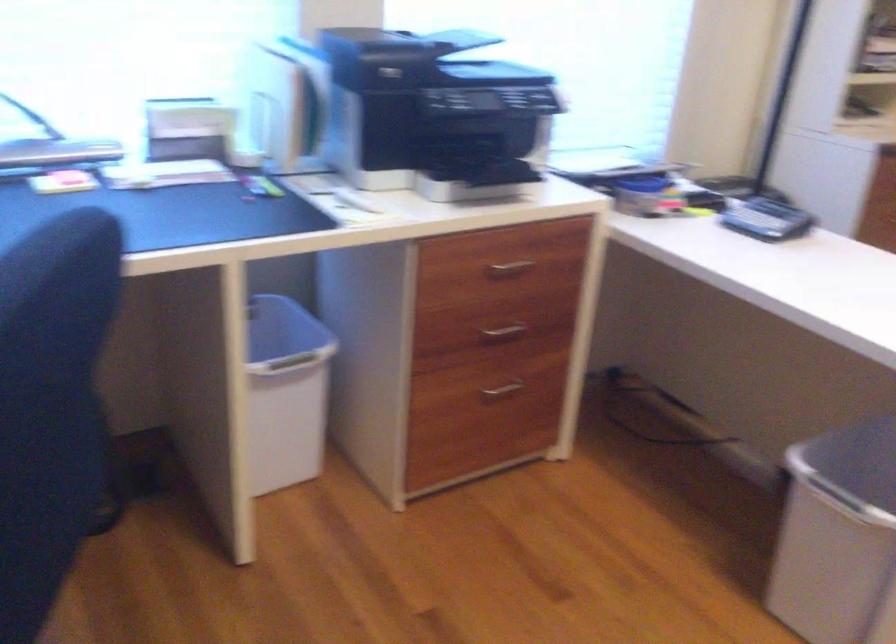
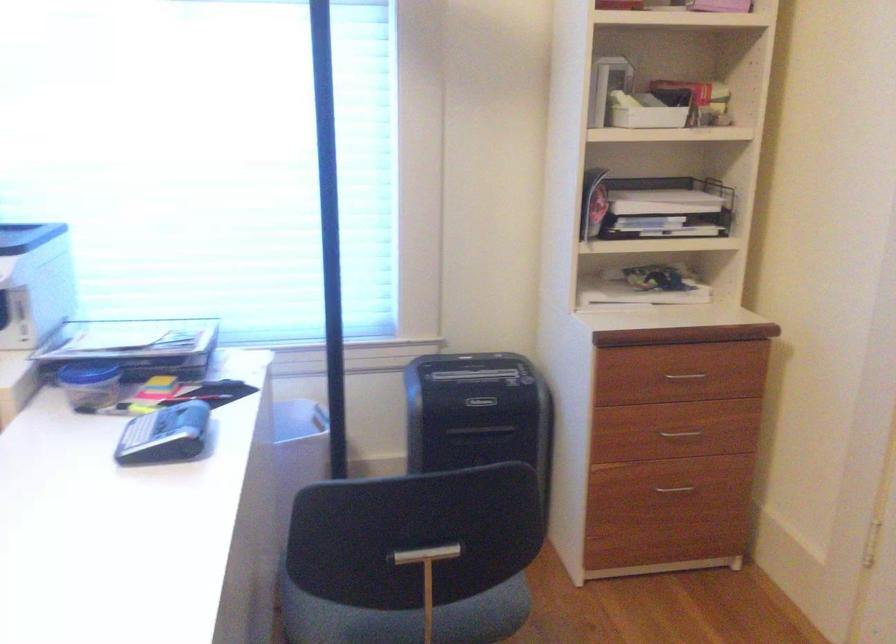
In a continuous first-person perspective shot, in which direction is the camera moving?

The cameraman moved toward right, forward.